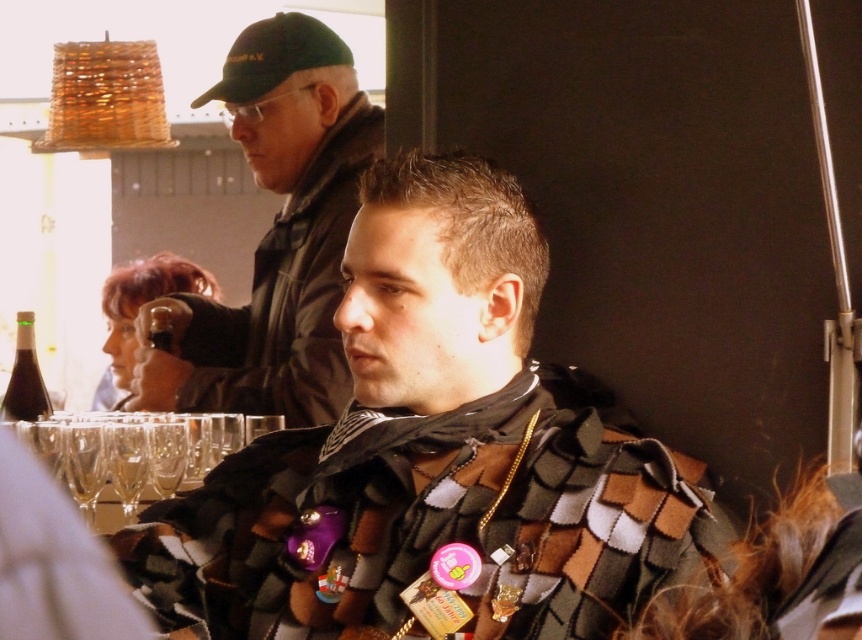
Question: Which of the following is the farthest from the observer?

Choices:
 (A) (233, 74)
 (B) (456, 355)
 (C) (242, 35)

Answer: (C)

Question: Which object is the closest to the green fabric baseball cap at upper left?

Choices:
 (A) clear glass wine glass at lower left
 (B) blonde hair at upper left

Answer: (B)

Question: Can you confirm if dark green cap at upper left is wider than blonde hair at upper left?

Choices:
 (A) no
 (B) yes

Answer: (B)

Question: Does dark green cap at upper left appear under clear glass wine glass at lower left?

Choices:
 (A) yes
 (B) no

Answer: (B)

Question: Does textured wool scarf at center appear on the right side of dark green cap at upper left?

Choices:
 (A) yes
 (B) no

Answer: (A)

Question: Based on their relative distances, which object is nearer to the blonde hair at upper left?

Choices:
 (A) short brown hair at center
 (B) green fabric baseball cap at upper left
 (C) textured wool scarf at center
 (D) clear glass wine glass at lower left

Answer: (B)